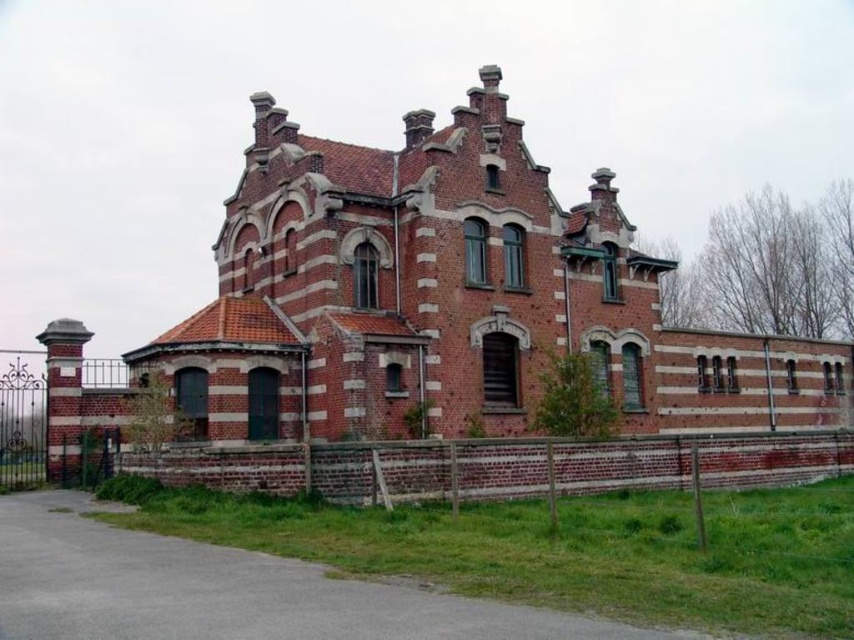
Question: Does brown brick wall at lower center appear on the right side of black wrought iron gate at left?

Choices:
 (A) no
 (B) yes

Answer: (B)

Question: Which point is farther to the camera?

Choices:
 (A) black wrought iron gate at left
 (B) brown brick wall at lower center

Answer: (A)

Question: Is brown brick wall at lower center to the right of black wrought iron gate at left from the viewer's perspective?

Choices:
 (A) no
 (B) yes

Answer: (B)

Question: Can you confirm if brown brick wall at lower center is bigger than black wrought iron gate at left?

Choices:
 (A) yes
 (B) no

Answer: (B)